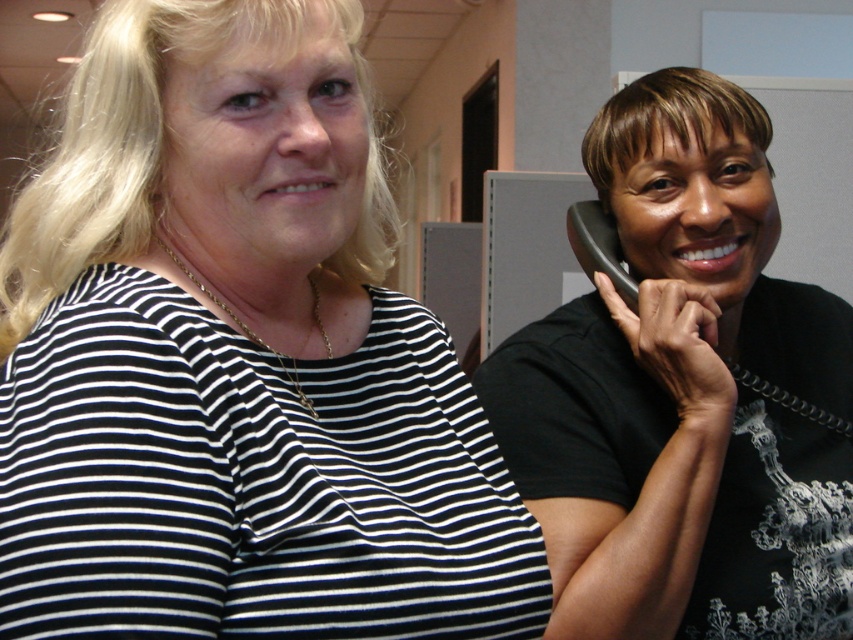
Question: Does black matte phone at right lie in front of black rubber phone at right?

Choices:
 (A) no
 (B) yes

Answer: (B)

Question: Is black matte phone at right wider than black rubber phone at right?

Choices:
 (A) no
 (B) yes

Answer: (B)

Question: Which point appears farthest from the camera in this image?

Choices:
 (A) (653, 141)
 (B) (635, 314)

Answer: (A)

Question: In this image, where is black striped shirt at upper left located relative to black matte phone at right?

Choices:
 (A) below
 (B) above

Answer: (B)

Question: Estimate the real-world distances between objects in this image. Which object is closer to the black striped shirt at upper left?

Choices:
 (A) black matte phone at right
 (B) black rubber phone at right

Answer: (A)

Question: Which of the following is the closest to the observer?

Choices:
 (A) black rubber phone at right
 (B) black matte phone at right
 (C) black striped shirt at upper left

Answer: (C)